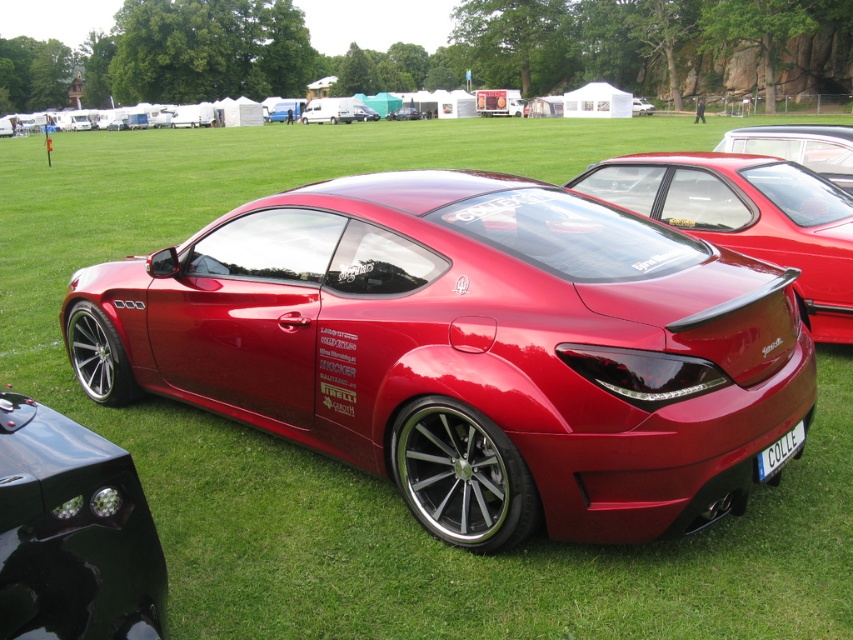
You are a photographer planning to capture both the shiny metallic sports car at center and the glossy black car at center in a single frame. Given their sizes, which car should you position closer to the camera to ensure both appear roughly the same size in the photo?

To make both cars appear roughly the same size in the photo, position the smaller glossy black car at center closer to the camera since the shiny metallic sports car at center is larger in size.